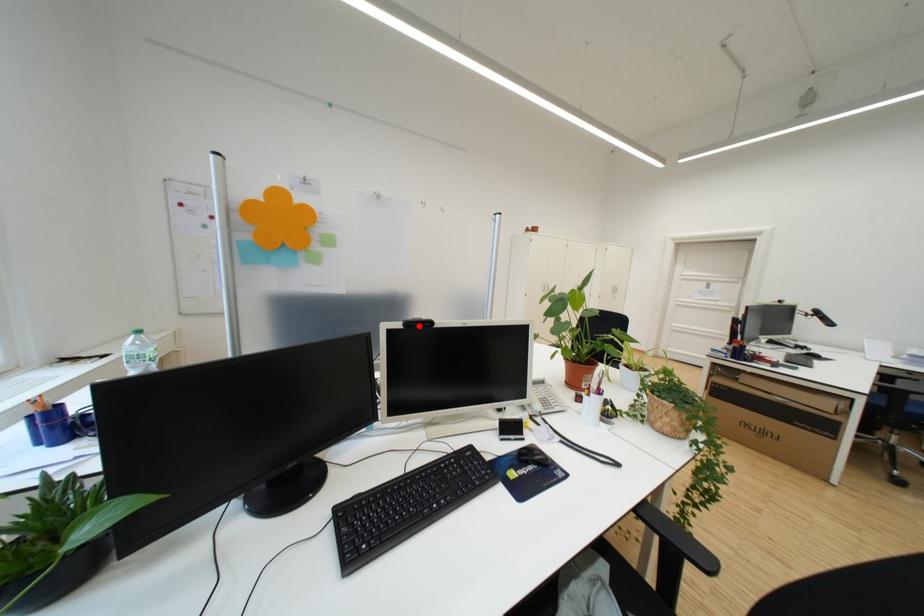
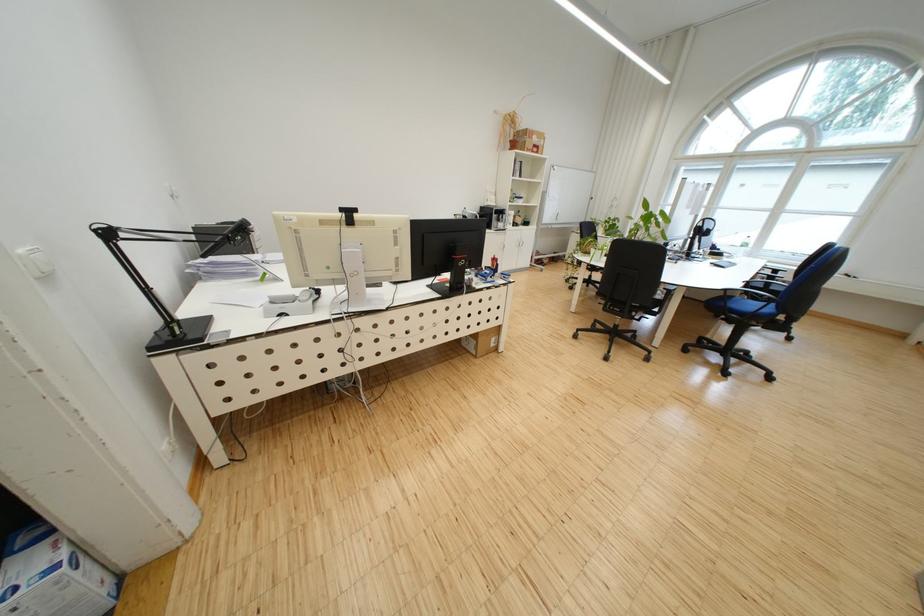
Question: I am providing you with two images of the same scene from different viewpoints. A red point is marked on the first image. Is the red point's position out of view in image 2?

Choices:
 (A) Yes
 (B) No

Answer: (A)